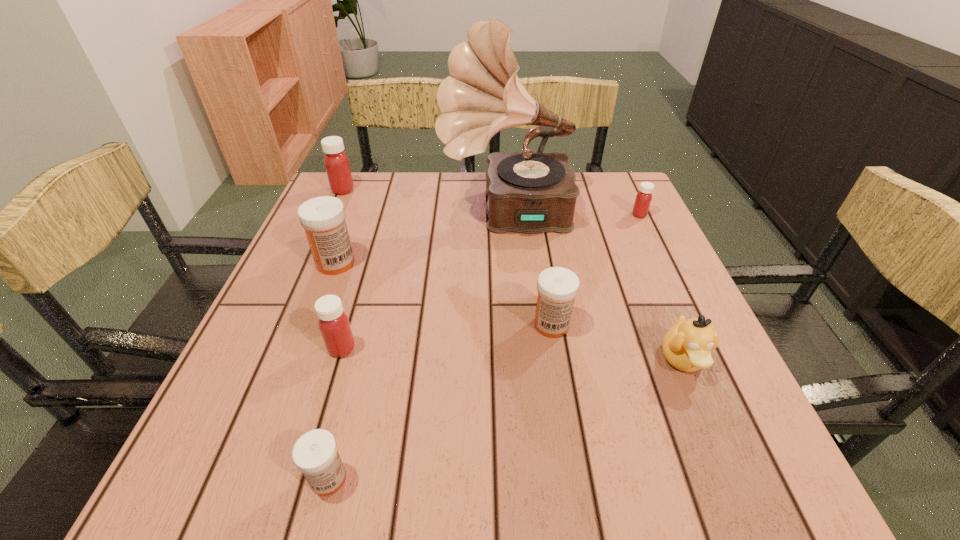
Where is `object that is at the far right corner`? The image size is (960, 540). object that is at the far right corner is located at coordinates (643, 199).

In order to click on free space at the far edge of the desktop in this screenshot , I will do `click(429, 175)`.

The height and width of the screenshot is (540, 960). In order to click on free location at the near edge of the desktop in this screenshot , I will do `click(630, 446)`.

The image size is (960, 540). I want to click on blank area at the left edge, so click(x=255, y=354).

In the image, there is a desktop. Where is `vacant space at the right edge`? This screenshot has width=960, height=540. vacant space at the right edge is located at coordinates (648, 378).

The width and height of the screenshot is (960, 540). I want to click on vacant point at the far left corner, so click(354, 176).

Identify the location of free space at the near left corner. The height and width of the screenshot is (540, 960). (182, 490).

At what (x,y) coordinates should I click in order to perform the action: click on free space at the far right corner. Please return your answer as a coordinate pair (x, y). This screenshot has width=960, height=540. Looking at the image, I should click on (623, 187).

The width and height of the screenshot is (960, 540). I want to click on empty space that is in between the second smallest red medicine and the brown record player, so click(x=424, y=281).

The image size is (960, 540). I want to click on vacant area between the tan duckling and the record player, so click(594, 287).